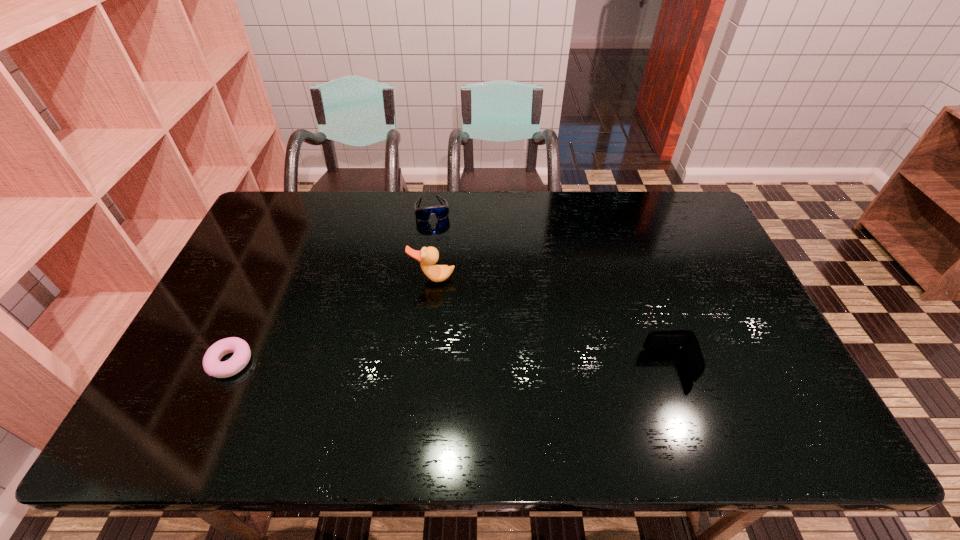
Identify which object is the second closest to the farthest object. Please provide its 2D coordinates. Your answer should be formatted as a tuple, i.e. [(x, y)], where the tuple contains the x and y coordinates of a point satisfying the conditions above.

[(212, 366)]

Image resolution: width=960 pixels, height=540 pixels. What are the coordinates of `the second closest object to the second farthest object` in the screenshot? It's located at (212, 366).

Locate an element on the screen. Image resolution: width=960 pixels, height=540 pixels. vacant space that satisfies the following two spatial constraints: 1. on the front side of the wallet; 2. on the outer surface of the sunglasses is located at coordinates (414, 366).

Where is `blank area in the image that satisfies the following two spatial constraints: 1. on the back side of the pastry; 2. on the left side of the sunglasses`? This screenshot has width=960, height=540. blank area in the image that satisfies the following two spatial constraints: 1. on the back side of the pastry; 2. on the left side of the sunglasses is located at coordinates (301, 209).

At what (x,y) coordinates should I click in order to perform the action: click on vacant space that satisfies the following two spatial constraints: 1. on the front side of the leftmost object; 2. on the outer surface of the rightmost object. Please return your answer as a coordinate pair (x, y). This screenshot has width=960, height=540. Looking at the image, I should click on click(228, 366).